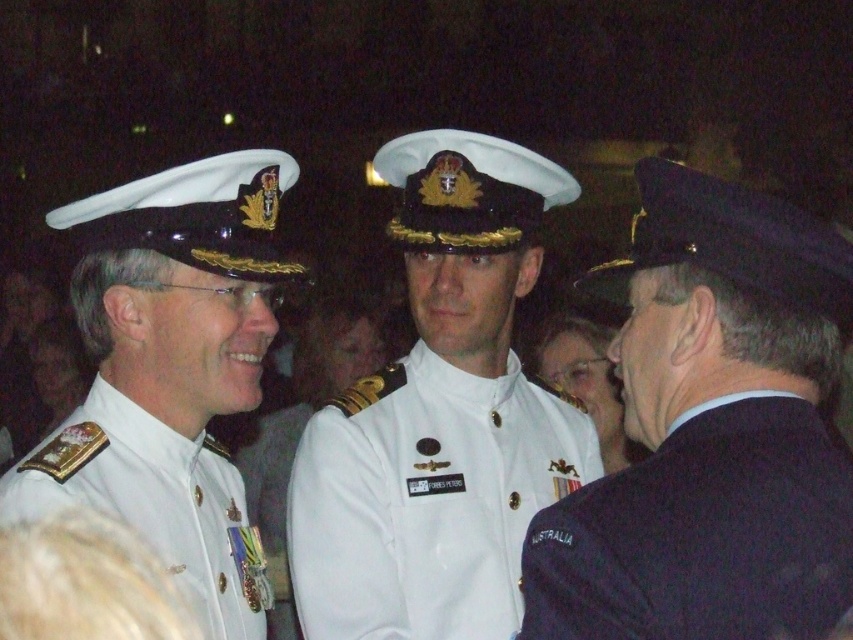
You are a photographer trying to capture a group photo of the white glossy uniform at center and the white matte uniform at left. Which uniform should you position closer to the camera to ensure both are visible in the frame?

The white glossy uniform at center might be wider than the white matte uniform at left, so positioning the white glossy uniform at center closer to the camera would help ensure both are visible in the frame.

You are a photographer at a military ceremony. You need to capture a photo of both the white glossy uniform at center and the dark blue wool blazer at right in the same frame. Considering their sizes, which one should you focus on to ensure both are clearly visible?

The white glossy uniform at center is bigger than the dark blue wool blazer at right. To ensure both are clearly visible, focus on the white glossy uniform at center as it is larger and will remain in focus while the smaller dark blue wool blazer at right can be included in the frame without being too small.